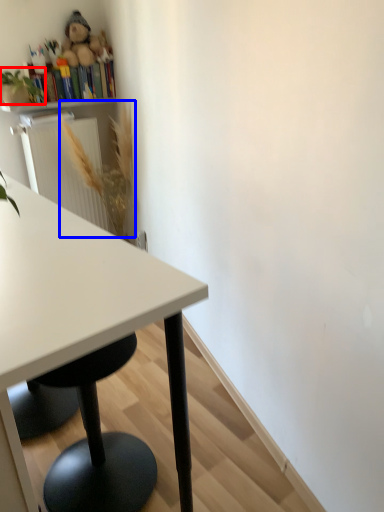
Question: Which of the following is the farthest to the observer, plant (highlighted by a red box) or flower (highlighted by a blue box)?

Choices:
 (A) plant
 (B) flower

Answer: (B)